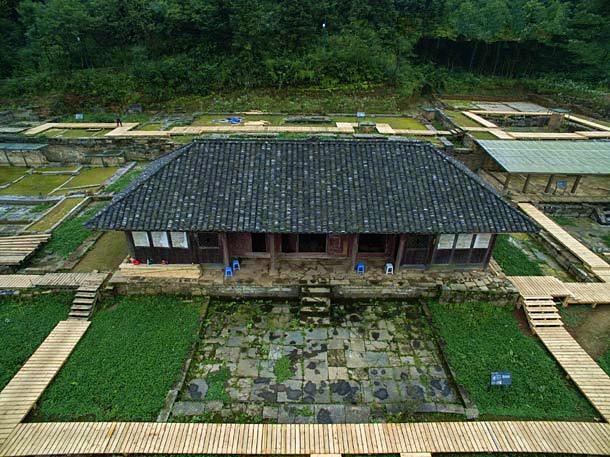
This screenshot has width=610, height=457. I want to click on entry, so click(349, 249).